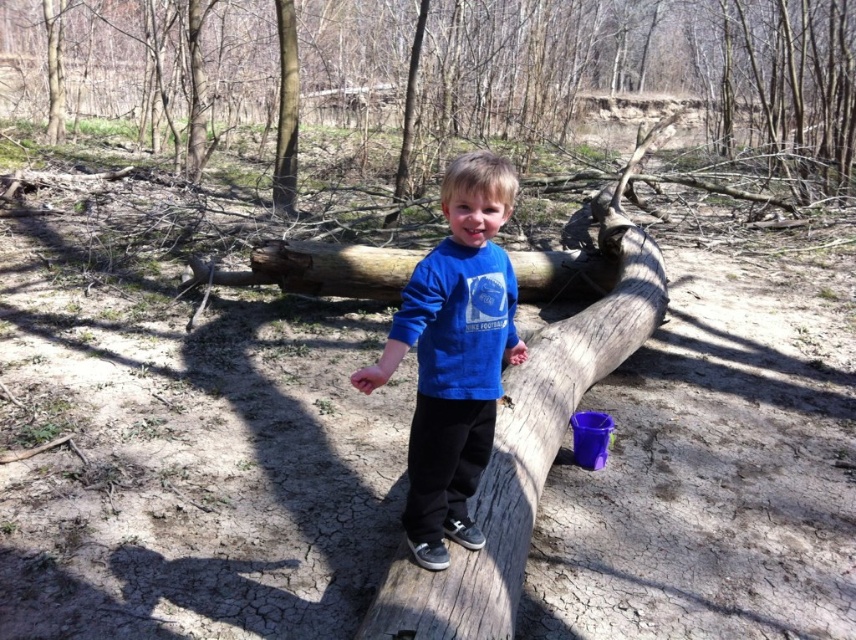
You are a parent trying to ensure your child stays safe while playing on the smooth brown log at center. Considering the blue cotton shirt at center is worn by the child, which object is a greater height concern for the child to avoid falling?

The smooth brown log at center is much taller than the blue cotton shirt at center, so the log poses a greater height concern for the child to avoid falling.

You are a park ranger who needs to measure the distance between the smooth brown log at center and the nearest tree. The nearest tree is 10 meters away from you. Can you reach the log before the tree?

The smooth brown log at center is 6.40 meters away from you, which is closer than the nearest tree at 10 meters. Therefore, you can reach the log before the tree.